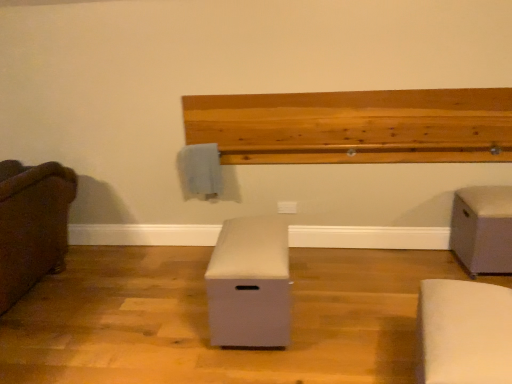
I want to click on empty space that is ontop of white fabric ottoman at lower right, acting as the 2th furniture starting from the right (from a real-world perspective), so click(x=479, y=311).